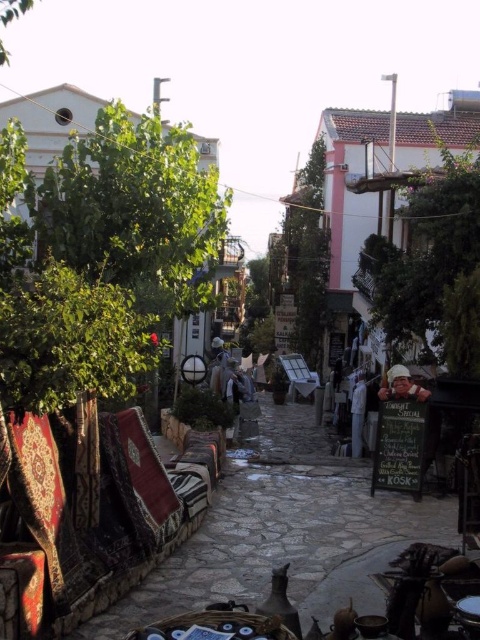
Question: Which point is farther to the camera?

Choices:
 (A) (356, 376)
 (B) (330, 564)

Answer: (A)

Question: Does carpeted rug at left appear on the right side of green leafy tree at upper right?

Choices:
 (A) no
 (B) yes

Answer: (A)

Question: Which point appears farthest from the camera in this image?

Choices:
 (A) (350, 404)
 (B) (476, 324)
 (C) (368, 545)

Answer: (A)

Question: Is carpeted rug at left in front of green leafy tree at upper right?

Choices:
 (A) yes
 (B) no

Answer: (A)

Question: Can you confirm if green leafy tree at upper right is bigger than white fabric at center?

Choices:
 (A) yes
 (B) no

Answer: (A)

Question: Among these objects, which one is farthest from the camera?

Choices:
 (A) white fabric at center
 (B) matte khaki helmet at center

Answer: (A)